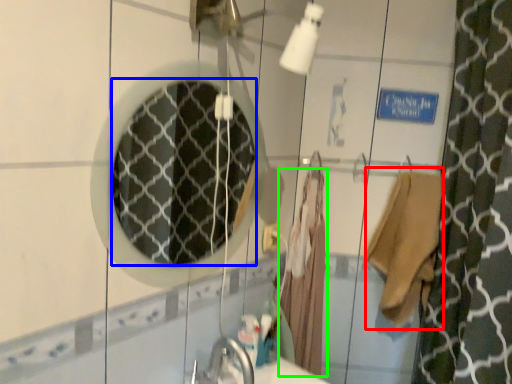
Question: Which is nearer to the robe (highlighted by a red box)? mirror (highlighted by a blue box) or bathrobe (highlighted by a green box).

Choices:
 (A) mirror
 (B) bathrobe

Answer: (B)